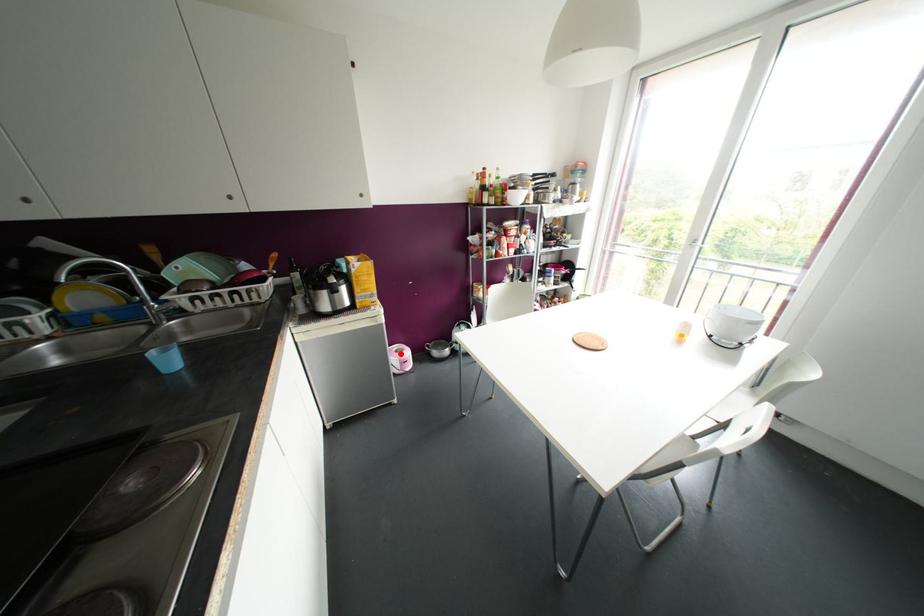
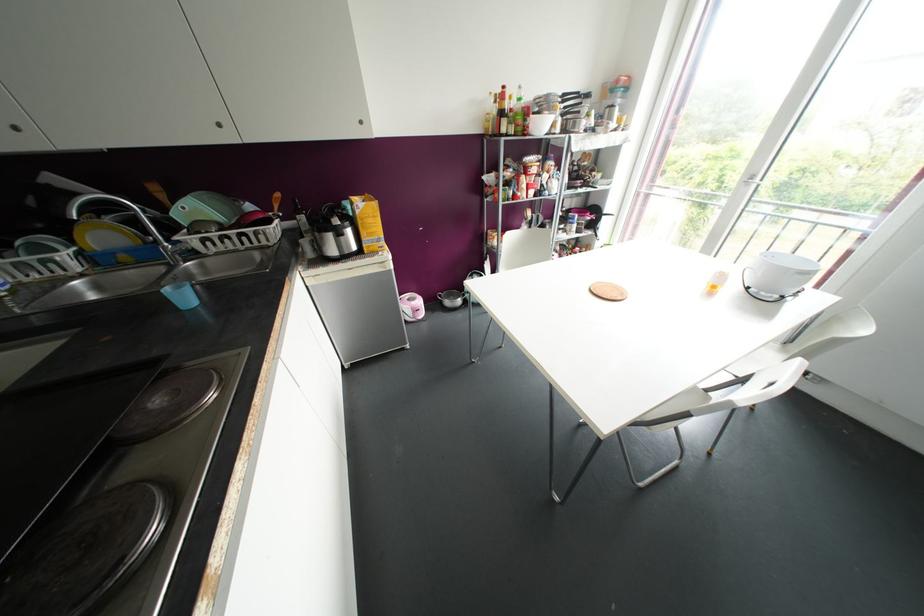
Question: A red point is marked in image1. In image2, is the corresponding 3D point closer to the camera or farther? Reply with the corresponding letter.

Choices:
 (A) The corresponding 3D point is closer.
 (B) The corresponding 3D point is farther.

Answer: (B)